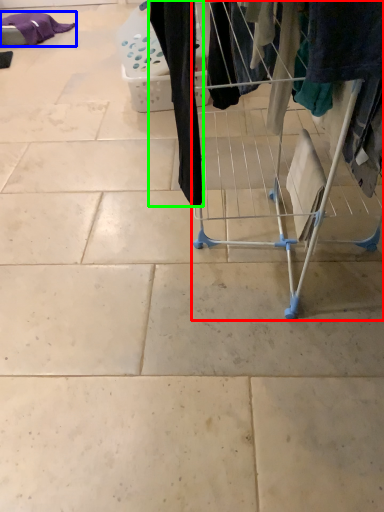
Question: Which is farther away from furniture (highlighted by a red box)? clothing (highlighted by a blue box) or clothing (highlighted by a green box)?

Choices:
 (A) clothing
 (B) clothing

Answer: (A)